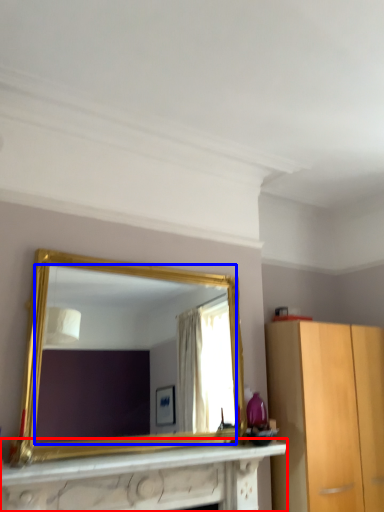
Question: Which point is further to the camera, vanity (highlighted by a red box) or mirror (highlighted by a blue box)?

Choices:
 (A) vanity
 (B) mirror

Answer: (B)